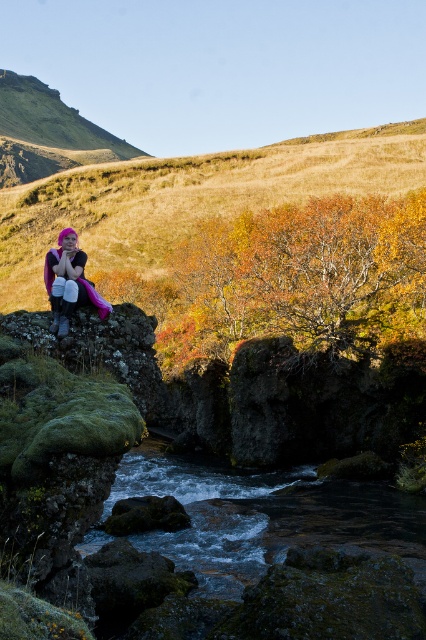
Question: Does dark gray rocky stream at center have a larger size compared to pink fabric at left?

Choices:
 (A) yes
 (B) no

Answer: (A)

Question: Can you confirm if dark gray rocky stream at center is positioned below pink fabric at left?

Choices:
 (A) yes
 (B) no

Answer: (A)

Question: Among these points, which one is farthest from the camera?

Choices:
 (A) pos(172,458)
 (B) pos(80,301)

Answer: (A)

Question: Does dark gray rocky stream at center appear on the right side of pink fabric at left?

Choices:
 (A) yes
 (B) no

Answer: (A)

Question: Which point appears farthest from the camera in this image?

Choices:
 (A) (60, 275)
 (B) (236, 570)

Answer: (B)

Question: Which point is closer to the camera taking this photo?

Choices:
 (A) tap(288, 524)
 (B) tap(75, 292)

Answer: (B)